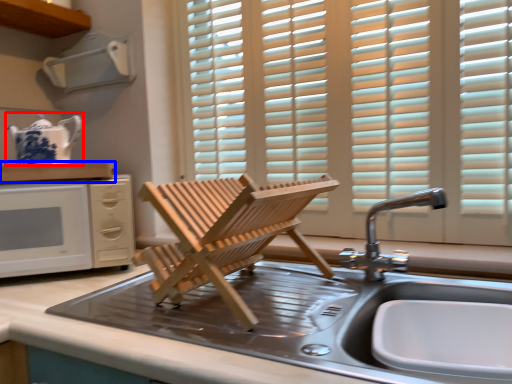
Question: Which point is further to the camera, tea pot (highlighted by a red box) or countertop (highlighted by a blue box)?

Choices:
 (A) tea pot
 (B) countertop

Answer: (A)